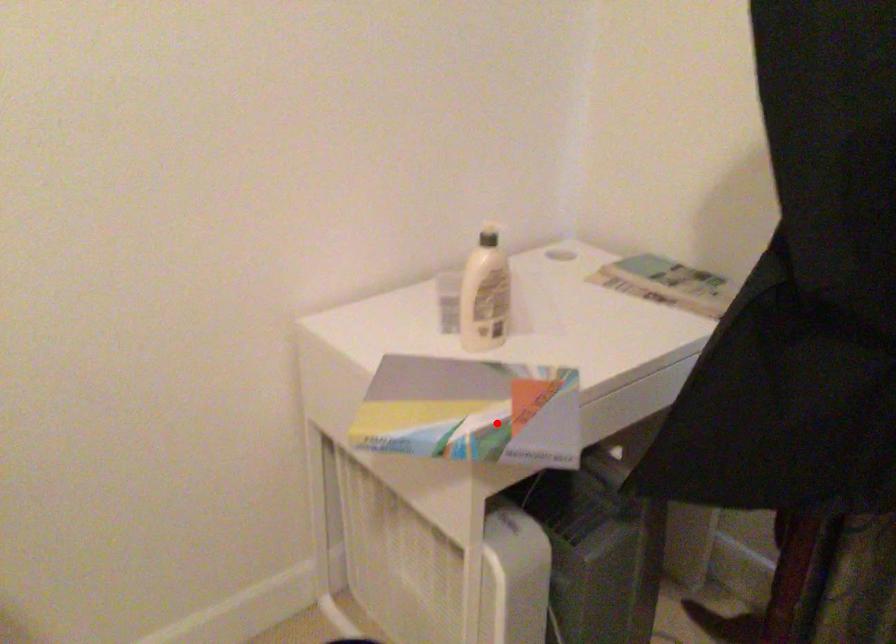
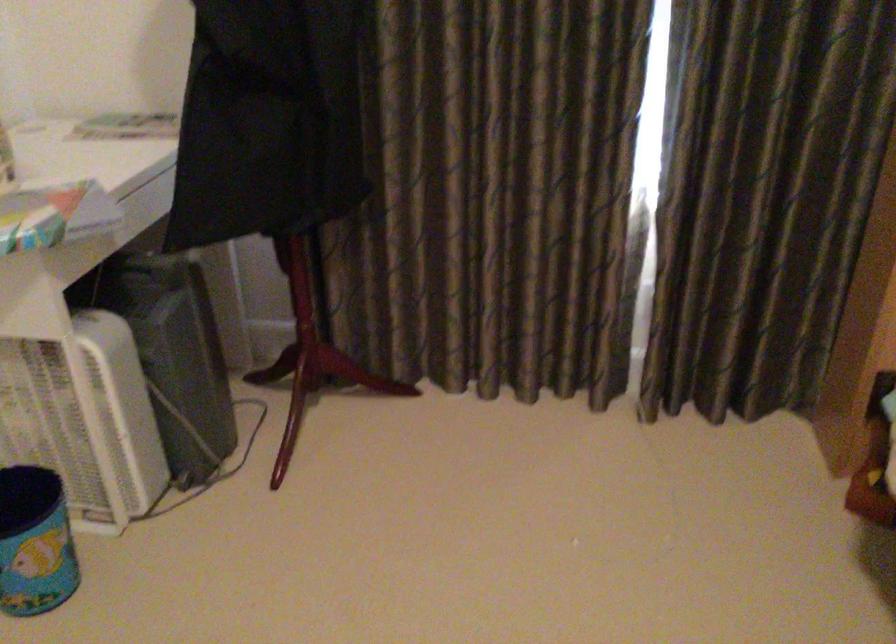
Question: I am providing you with two images of the same scene from different viewpoints. Given a red point in image1, look at the same physical point in image2. Is it:

Choices:
 (A) Closer to the viewpoint
 (B) Farther from the viewpoint

Answer: (B)